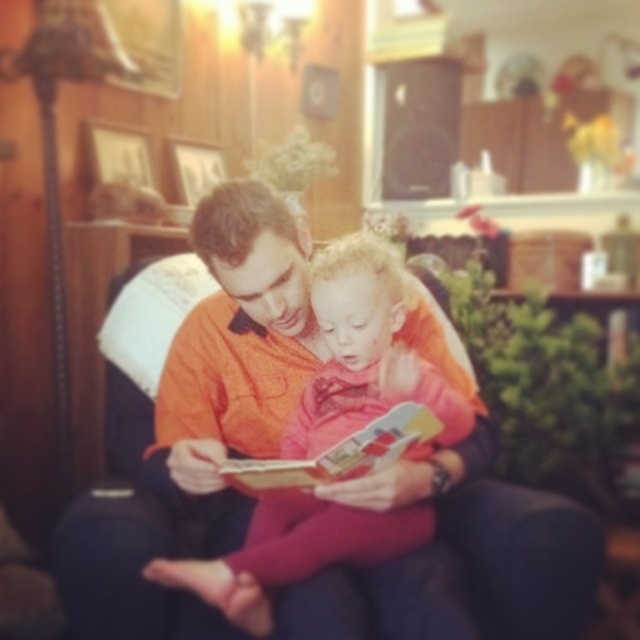
Question: Is pink fabric at center positioned at the back of hardcover book at center?

Choices:
 (A) no
 (B) yes

Answer: (A)

Question: Among these points, which one is farthest from the camera?

Choices:
 (A) (356, 467)
 (B) (292, 566)

Answer: (B)

Question: Does pink fabric at center have a greater width compared to hardcover book at center?

Choices:
 (A) no
 (B) yes

Answer: (B)

Question: Is pink fabric at center closer to the viewer compared to hardcover book at center?

Choices:
 (A) no
 (B) yes

Answer: (B)

Question: Which of the following is the closest to the observer?

Choices:
 (A) (355, 435)
 (B) (420, 548)

Answer: (A)